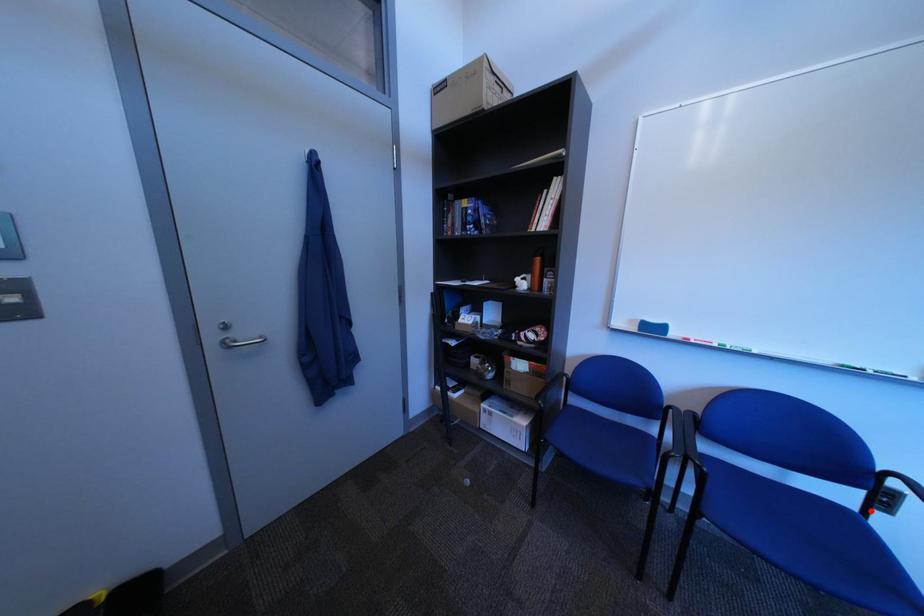
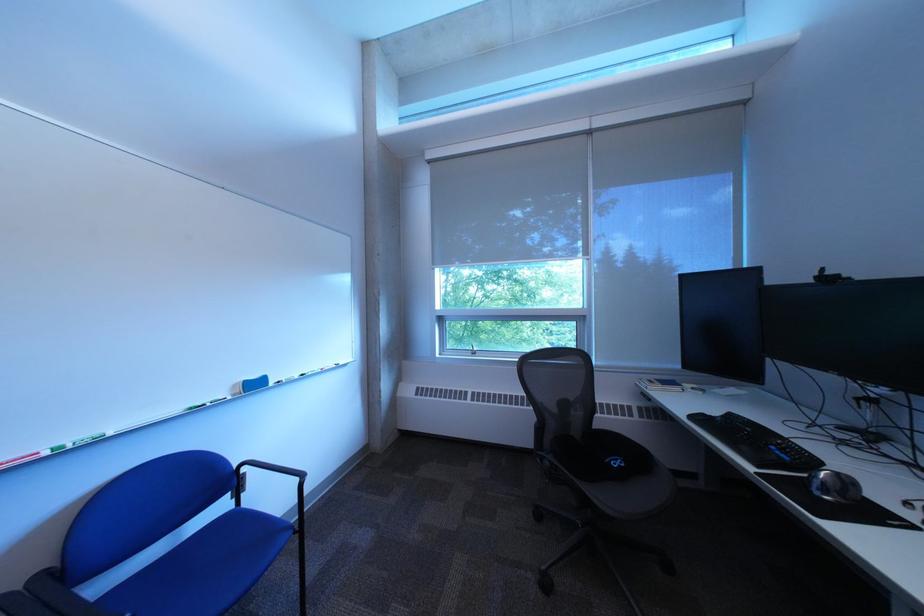
Question: I am providing you with two images of the same scene from different viewpoints. Image1 has a red point marked. In image2, the corresponding 3D location appears at what relative position? Reply with the corresponding letter.

Choices:
 (A) Closer
 (B) Farther

Answer: (A)